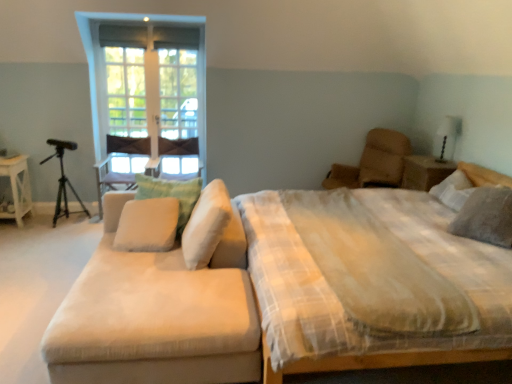
Describe the element at coordinates (148, 50) in the screenshot. I see `clear glass door at upper center` at that location.

This screenshot has width=512, height=384. Describe the element at coordinates (374, 162) in the screenshot. I see `leather swivel chair at upper right` at that location.

Describe the element at coordinates (195, 321) in the screenshot. The image size is (512, 384). I see `plaid fabric bed at center` at that location.

This screenshot has height=384, width=512. Identify the location of black matte tripod at left. (63, 180).

In order to face beige fabric pillow at center, the third pillow viewed from the left, should I rotate leftwards or rightwards?

You should rotate left by 6.649 degrees.

Identify the location of beige fabric pillow at center, the third pillow viewed from the left. (206, 225).

Find the location of a particular element. The width and height of the screenshot is (512, 384). beige fabric armchair at center is located at coordinates (120, 152).

Image resolution: width=512 pixels, height=384 pixels. Find the location of `clear glass door at upper center`. clear glass door at upper center is located at coordinates (148, 50).

Is clear glass door at upper center at the right side of beige fabric armchair at center?

Indeed, clear glass door at upper center is positioned on the right side of beige fabric armchair at center.

From the picture: From the image's perspective, is clear glass door at upper center positioned above or below beige fabric armchair at center?

Clearly, from the image's perspective, clear glass door at upper center is above beige fabric armchair at center.

Considering the positions of points (91, 91) and (196, 139), is point (91, 91) closer to camera compared to point (196, 139)?

Yes, it is.

From a real-world perspective, between gray textured pillow at right, the first pillow in the right-to-left sequence, and leather swivel chair at upper right, who is vertically lower?

From a 3D spatial view, leather swivel chair at upper right is below.

Find the location of `swivel chair lying behind the gray textured pillow at right, arranged as the 4th pillow when viewed from the left`. swivel chair lying behind the gray textured pillow at right, arranged as the 4th pillow when viewed from the left is located at coordinates (374, 162).

Is gray textured pillow at right, the first pillow in the right-to-left sequence, surrounding leather swivel chair at upper right?

No.

From the image's perspective, is black matte tripod at left located beneath beige fabric pillow at center, arranged as the 4th pillow when viewed from the right?

Actually, black matte tripod at left appears above beige fabric pillow at center, arranged as the 4th pillow when viewed from the right, in the image.

Can you confirm if black matte tripod at left is smaller than beige fabric pillow at center, arranged as the first pillow when viewed from the left?

Incorrect, black matte tripod at left is not smaller in size than beige fabric pillow at center, arranged as the first pillow when viewed from the left.

Can you confirm if black matte tripod at left is thinner than beige fabric pillow at center, arranged as the 4th pillow when viewed from the right?

Yes.

Is point (50, 144) positioned behind point (137, 233)?

That is True.

Is clear glass door at upper center positioned behind beige fabric pillow at center, arranged as the 4th pillow when viewed from the right?

Yes, clear glass door at upper center is behind beige fabric pillow at center, arranged as the 4th pillow when viewed from the right.

Considering the sizes of objects clear glass door at upper center and beige fabric pillow at center, arranged as the first pillow when viewed from the left, in the image provided, who is bigger, clear glass door at upper center or beige fabric pillow at center, arranged as the first pillow when viewed from the left,?

beige fabric pillow at center, arranged as the first pillow when viewed from the left.

Is clear glass door at upper center not inside beige fabric pillow at center, arranged as the first pillow when viewed from the left?

Yes.

Which of these two, clear glass door at upper center or beige fabric pillow at center, arranged as the first pillow when viewed from the left, stands taller?

With more height is clear glass door at upper center.

Is gray textured pillow at right, arranged as the 4th pillow when viewed from the left, aimed at green fabric pillow at center, the third pillow viewed from the right?

Yes.

Which object is wider, gray textured pillow at right, the first pillow in the right-to-left sequence, or green fabric pillow at center, which is the 2th pillow from left to right?

green fabric pillow at center, which is the 2th pillow from left to right, is wider.

Which object is positioned more to the right, gray textured pillow at right, the first pillow in the right-to-left sequence, or green fabric pillow at center, the third pillow viewed from the right?

gray textured pillow at right, the first pillow in the right-to-left sequence, is more to the right.

Would you say black matte tripod at left is inside or outside clear glass door at upper center?

black matte tripod at left is not inside clear glass door at upper center, it's outside.

Find the location of a particular element. window on the right side of black matte tripod at left is located at coordinates (148, 50).

Considering the sizes of black matte tripod at left and clear glass door at upper center in the image, is black matte tripod at left taller or shorter than clear glass door at upper center?

Considering their sizes, black matte tripod at left has less height than clear glass door at upper center.

Considering the sizes of white wood side table at left, which ranks as the first nightstand in left-to-right order, and clear glass door at upper center in the image, is white wood side table at left, which ranks as the first nightstand in left-to-right order, wider or thinner than clear glass door at upper center?

Considering their sizes, white wood side table at left, which ranks as the first nightstand in left-to-right order, looks broader than clear glass door at upper center.

Is white wood side table at left, which ranks as the first nightstand in left-to-right order, turned away from clear glass door at upper center?

No, white wood side table at left, which ranks as the first nightstand in left-to-right order, is not facing the opposite direction of clear glass door at upper center.

Locate an element on the screen. Image resolution: width=512 pixels, height=384 pixels. nightstand lying on the left of clear glass door at upper center is located at coordinates (17, 188).

Which is in front, white wood side table at left, which ranks as the 2th nightstand in right-to-left order, or clear glass door at upper center?

Positioned in front is white wood side table at left, which ranks as the 2th nightstand in right-to-left order.

Image resolution: width=512 pixels, height=384 pixels. Find the location of `window to the right of beige fabric armchair at center`. window to the right of beige fabric armchair at center is located at coordinates (148, 50).

Find the location of a particular element. the 2nd pillow below when counting from the leather swivel chair at upper right (from the image's perspective) is located at coordinates (486, 216).

Based on their spatial positions, is clear glass door at upper center or beige fabric pillow at center, arranged as the first pillow when viewed from the left, closer to white wood side table at left, which ranks as the first nightstand in left-to-right order?

clear glass door at upper center is closer to white wood side table at left, which ranks as the first nightstand in left-to-right order.

Based on the photo, considering their positions, is beige fabric couch at left positioned closer to beige fabric pillow at center, arranged as the first pillow when viewed from the left, than clear glass door at upper center?

beige fabric couch at left lies closer to beige fabric pillow at center, arranged as the first pillow when viewed from the left, than the other object.

Which object lies nearer to the anchor point clear glass door at upper center, white wood side table at left, which ranks as the first nightstand in left-to-right order, or beige fabric armchair at center?

Based on the image, beige fabric armchair at center appears to be nearer to clear glass door at upper center.

Considering their positions, is white wood side table at left, which ranks as the 2th nightstand in right-to-left order, positioned further to black matte tripod at left than beige fabric pillow at center, which appears as the second pillow when viewed from the right?

Among the two, beige fabric pillow at center, which appears as the second pillow when viewed from the right, is located further to black matte tripod at left.

Consider the image. Looking at the image, which one is located closer to gray textured pillow at right, arranged as the 4th pillow when viewed from the left, beige fabric pillow at center, the third pillow viewed from the left, or white fabric nightstand at right, which appears as the first nightstand when viewed from the right?

Based on the image, white fabric nightstand at right, which appears as the first nightstand when viewed from the right, appears to be nearer to gray textured pillow at right, arranged as the 4th pillow when viewed from the left.

Based on their spatial positions, is leather swivel chair at upper right or green fabric pillow at center, which is the 2th pillow from left to right, further from white fabric nightstand at right, which is the 2th nightstand from left to right?

Based on the image, green fabric pillow at center, which is the 2th pillow from left to right, appears to be further to white fabric nightstand at right, which is the 2th nightstand from left to right.

When comparing their distances from white wood side table at left, which ranks as the first nightstand in left-to-right order, does beige fabric pillow at center, arranged as the first pillow when viewed from the left, or black matte tripod at left seem further?

The object further to white wood side table at left, which ranks as the first nightstand in left-to-right order, is beige fabric pillow at center, arranged as the first pillow when viewed from the left.

Which object lies nearer to the anchor point white fabric nightstand at right, which is the 2th nightstand from left to right, gray textured pillow at right, the first pillow in the right-to-left sequence, or beige fabric pillow at center, the third pillow viewed from the left?

gray textured pillow at right, the first pillow in the right-to-left sequence, is closer to white fabric nightstand at right, which is the 2th nightstand from left to right.

Where is `nightstand situated between beige fabric pillow at center, arranged as the 4th pillow when viewed from the right, and gray textured pillow at right, the first pillow in the right-to-left sequence, from left to right`? This screenshot has width=512, height=384. nightstand situated between beige fabric pillow at center, arranged as the 4th pillow when viewed from the right, and gray textured pillow at right, the first pillow in the right-to-left sequence, from left to right is located at coordinates pos(424,172).

The width and height of the screenshot is (512, 384). What are the coordinates of `window between beige fabric armchair at center and white fabric nightstand at right, which is the 2th nightstand from left to right` in the screenshot? It's located at (148, 50).

The image size is (512, 384). In order to click on tripod located between white wood side table at left, which ranks as the first nightstand in left-to-right order, and white glossy table lamp at upper right in the left-right direction in this screenshot , I will do `click(63, 180)`.

Where is `studio couch between beige fabric armchair at center and gray textured pillow at right, arranged as the 4th pillow when viewed from the left`? This screenshot has height=384, width=512. studio couch between beige fabric armchair at center and gray textured pillow at right, arranged as the 4th pillow when viewed from the left is located at coordinates (160, 299).